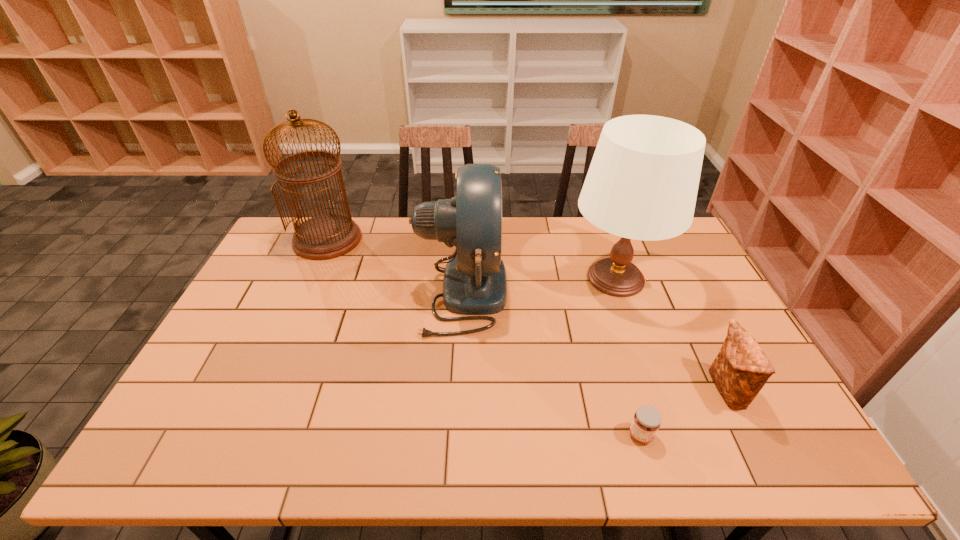
Point out which object is positioned as the nearest to the jam. Please provide its 2D coordinates. Your answer should be formatted as a tuple, i.e. [(x, y)], where the tuple contains the x and y coordinates of a point satisfying the conditions above.

[(741, 369)]

Image resolution: width=960 pixels, height=540 pixels. I want to click on free space that satisfies the following two spatial constraints: 1. on the front-facing side of the birdcage; 2. on the left side of the lamp, so pos(310,278).

Locate an element on the screen. Image resolution: width=960 pixels, height=540 pixels. vacant area that satisfies the following two spatial constraints: 1. in front of the fan to blow air; 2. on the left side of the jam is located at coordinates (455, 435).

Locate an element on the screen. The width and height of the screenshot is (960, 540). free region that satisfies the following two spatial constraints: 1. on the front-facing side of the lamp; 2. on the left side of the birdcage is located at coordinates (310, 278).

Identify the location of vacant region that satisfies the following two spatial constraints: 1. in front of the shortest object to blow air; 2. on the left side of the fourth object from right to left. (455, 435).

In order to click on vacant space that satisfies the following two spatial constraints: 1. in front of the fan to blow air; 2. on the right side of the jam in this screenshot , I will do `click(455, 435)`.